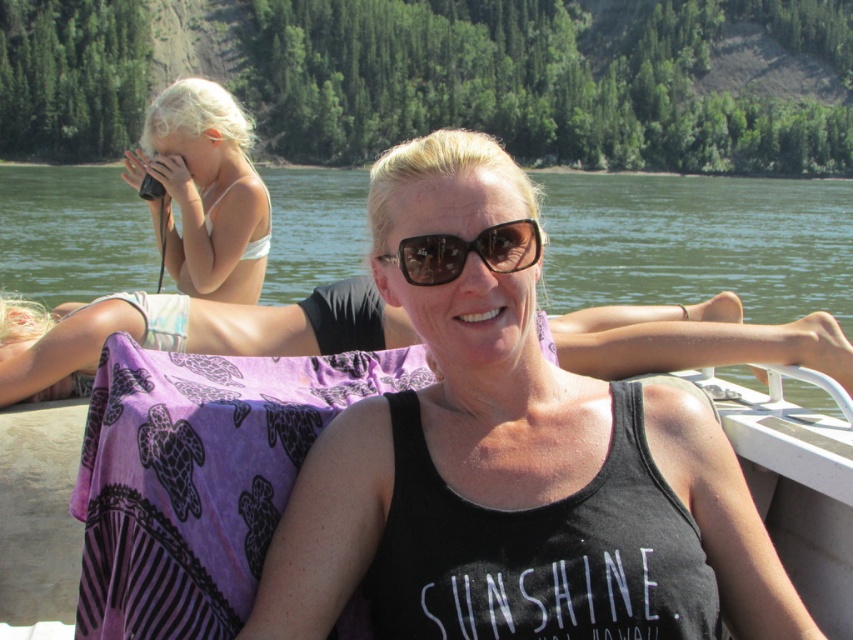
Question: Does clear water at center appear under brown matte sunglasses at center?

Choices:
 (A) no
 (B) yes

Answer: (A)

Question: Which of the following is the farthest from the observer?

Choices:
 (A) (x=769, y=344)
 (B) (x=606, y=484)
 (C) (x=149, y=113)

Answer: (C)

Question: Which point is closer to the camera taking this photo?

Choices:
 (A) (247, 262)
 (B) (343, 326)

Answer: (B)

Question: Does clear water at center lie in front of brown matte sunglasses at center?

Choices:
 (A) yes
 (B) no

Answer: (B)

Question: Can you confirm if black tank top at center is smaller than white bikini at upper left?

Choices:
 (A) yes
 (B) no

Answer: (A)

Question: Which object is the closest to the black tank top at center?

Choices:
 (A) brown matte sunglasses at center
 (B) clear water at center

Answer: (A)